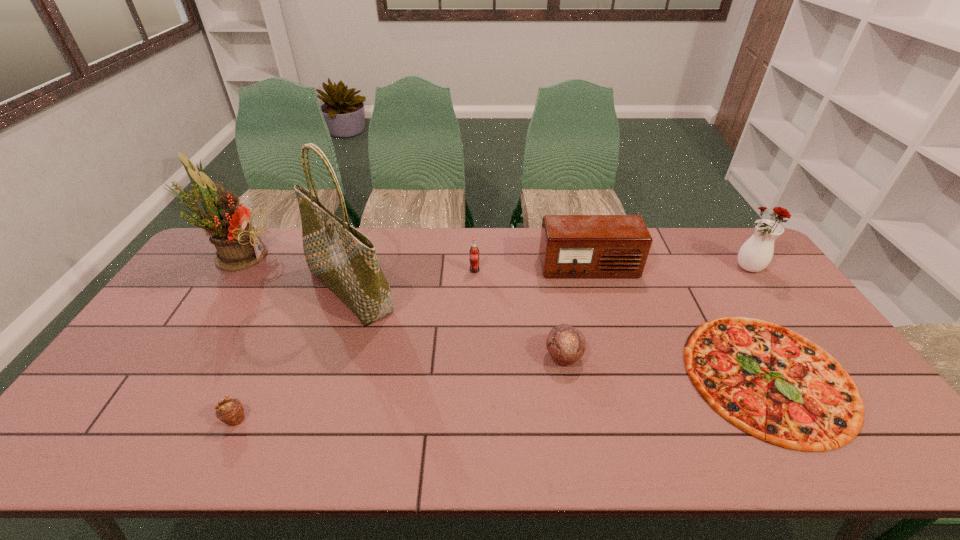
I want to click on object that is at the far left corner, so click(238, 244).

At what (x,y) coordinates should I click in order to perform the action: click on object at the far right corner. Please return your answer as a coordinate pair (x, y). This screenshot has height=540, width=960. Looking at the image, I should click on (755, 254).

Where is `object that is positioned at the near right corner`? The image size is (960, 540). object that is positioned at the near right corner is located at coordinates (771, 382).

You are a GUI agent. You are given a task and a screenshot of the screen. Output one action in this format:
    pyautogui.click(x=<x>, y=<y>)
    Task: Click on the vacant region at the far edge
    The width and height of the screenshot is (960, 540).
    Given the screenshot: What is the action you would take?
    pyautogui.click(x=676, y=263)

I want to click on free space at the near edge, so coord(151,449).

Find the location of a particular element. Image resolution: width=960 pixels, height=540 pixels. free point between the vase and the shorter muffin is located at coordinates (492, 344).

Where is `free area in between the pizza and the fifth tallest object`? free area in between the pizza and the fifth tallest object is located at coordinates (621, 323).

Where is `empty space that is in between the second tallest object and the nearer muffin`? empty space that is in between the second tallest object and the nearer muffin is located at coordinates pos(235,337).

Where is `free spot between the tallest object and the seventh tallest object`? free spot between the tallest object and the seventh tallest object is located at coordinates (293, 355).

Where is `free spot between the leftmost object and the fourth tallest object`? The height and width of the screenshot is (540, 960). free spot between the leftmost object and the fourth tallest object is located at coordinates (413, 261).